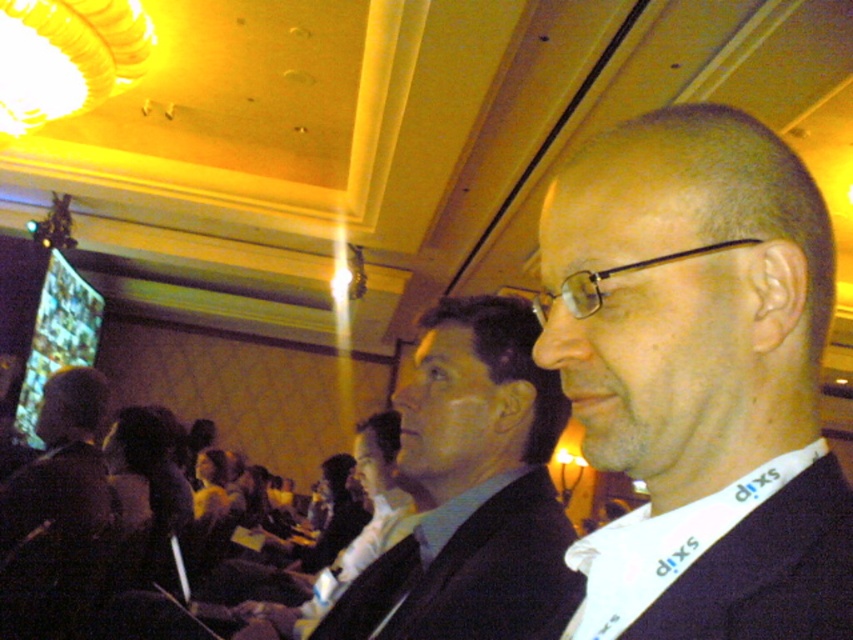
Does dark blue suit at center come behind dark suit at center?

No, it is not.

This screenshot has height=640, width=853. Identify the location of dark blue suit at center. (698, 378).

Find the location of a particular element. This screenshot has width=853, height=640. dark blue suit at center is located at coordinates (698, 378).

Does dark blue suit at center appear under dark brown leather jacket at left?

Actually, dark blue suit at center is above dark brown leather jacket at left.

From the picture: Who is shorter, dark blue suit at center or dark brown leather jacket at left?

With less height is dark blue suit at center.

Which is behind, point (640, 298) or point (39, 580)?

Positioned behind is point (39, 580).

You are a GUI agent. You are given a task and a screenshot of the screen. Output one action in this format:
    pyautogui.click(x=<x>, y=<y>)
    Task: Click on the dark blue suit at center
    
    Given the screenshot: What is the action you would take?
    pyautogui.click(x=698, y=378)

At what (x,y) coordinates should I click in order to perform the action: click on dark suit at center. Please return your answer as a coordinate pair (x, y). This screenshot has width=853, height=640. Looking at the image, I should click on (469, 488).

Does point (509, 422) come farther from viewer compared to point (62, 401)?

No, (509, 422) is closer to viewer.

Who is more forward, (426, 490) or (44, 600)?

Positioned in front is point (426, 490).

This screenshot has width=853, height=640. In order to click on dark suit at center in this screenshot , I will do `click(469, 488)`.